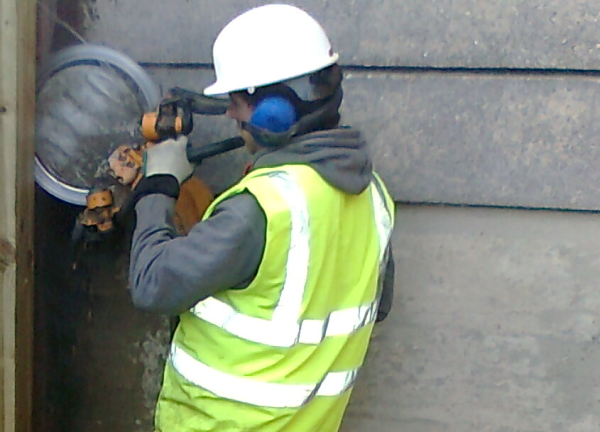
I want to click on wood beam, so click(x=13, y=332), click(x=8, y=69).